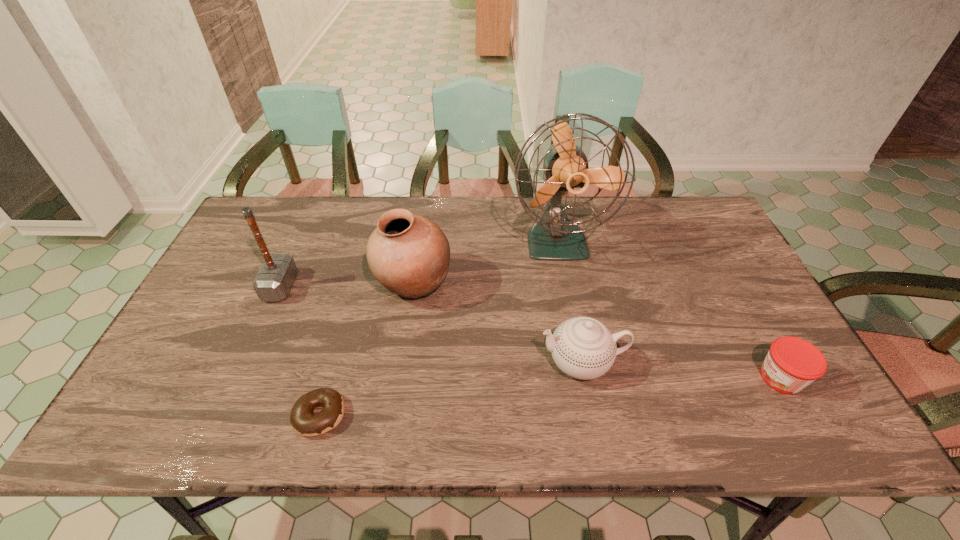
This screenshot has height=540, width=960. Identify the location of free spot between the rightmost object and the shortest object. (550, 396).

Find the location of a particular element. Image resolution: width=960 pixels, height=540 pixels. free space between the pottery and the leftmost object is located at coordinates (347, 285).

Find the location of a particular element. The width and height of the screenshot is (960, 540). free point between the shortest object and the leftmost object is located at coordinates (300, 351).

Identify which object is the third closest to the shortest object. Please provide its 2D coordinates. Your answer should be formatted as a tuple, i.e. [(x, y)], where the tuple contains the x and y coordinates of a point satisfying the conditions above.

[(584, 348)]

The width and height of the screenshot is (960, 540). I want to click on object that is the closest to the chinaware, so click(554, 237).

Identify the location of free space that satisfies the following two spatial constraints: 1. on the label side of the fifth tallest object; 2. on the front side of the doughnut. This screenshot has width=960, height=540. (802, 415).

Where is `free space that satisfies the following two spatial constraints: 1. on the label side of the jam; 2. on the front side of the doughnut`? The image size is (960, 540). free space that satisfies the following two spatial constraints: 1. on the label side of the jam; 2. on the front side of the doughnut is located at coordinates (802, 415).